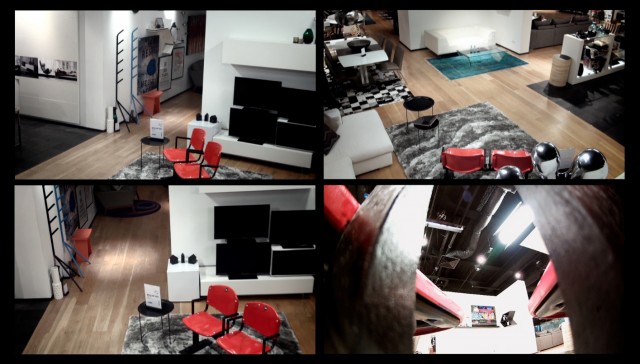
Where is `monitor`? monitor is located at coordinates (240, 261).